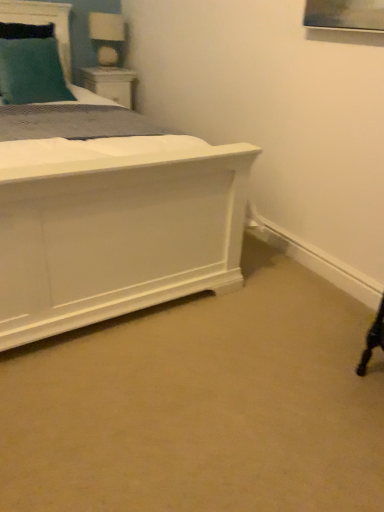
Question: Could you tell me if teal fabric headboard at upper left is turned towards white wood nightstand at upper left?

Choices:
 (A) no
 (B) yes

Answer: (A)

Question: Is teal fabric headboard at upper left far away from white wood nightstand at upper left?

Choices:
 (A) no
 (B) yes

Answer: (A)

Question: From a real-world perspective, is teal fabric headboard at upper left located beneath white wood nightstand at upper left?

Choices:
 (A) no
 (B) yes

Answer: (A)

Question: Considering the relative sizes of teal fabric headboard at upper left and white wood nightstand at upper left in the image provided, is teal fabric headboard at upper left thinner than white wood nightstand at upper left?

Choices:
 (A) no
 (B) yes

Answer: (B)

Question: Is teal fabric headboard at upper left next to white wood nightstand at upper left and touching it?

Choices:
 (A) no
 (B) yes

Answer: (A)

Question: From a real-world perspective, is white wood nightstand at upper left above or below white glossy table lamp at upper left?

Choices:
 (A) above
 (B) below

Answer: (B)

Question: Is white wood nightstand at upper left inside or outside of white glossy table lamp at upper left?

Choices:
 (A) inside
 (B) outside

Answer: (B)

Question: Is white wood nightstand at upper left taller or shorter than white glossy table lamp at upper left?

Choices:
 (A) tall
 (B) short

Answer: (B)

Question: In the image, is white wood nightstand at upper left positioned in front of or behind white glossy table lamp at upper left?

Choices:
 (A) front
 (B) behind

Answer: (B)

Question: From a real-world perspective, is teal fabric headboard at upper left positioned above or below teal fabric pillow at upper left?

Choices:
 (A) below
 (B) above

Answer: (B)

Question: Do you think teal fabric headboard at upper left is within teal fabric pillow at upper left, or outside of it?

Choices:
 (A) outside
 (B) inside

Answer: (A)

Question: From their relative heights in the image, would you say teal fabric headboard at upper left is taller or shorter than teal fabric pillow at upper left?

Choices:
 (A) short
 (B) tall

Answer: (A)

Question: Considering the positions of teal fabric headboard at upper left and teal fabric pillow at upper left in the image, is teal fabric headboard at upper left wider or thinner than teal fabric pillow at upper left?

Choices:
 (A) thin
 (B) wide

Answer: (A)

Question: Is teal fabric headboard at upper left situated inside white wood nightstand at upper left or outside?

Choices:
 (A) outside
 (B) inside

Answer: (A)

Question: Visually, is teal fabric headboard at upper left positioned to the left or to the right of white wood nightstand at upper left?

Choices:
 (A) right
 (B) left

Answer: (B)